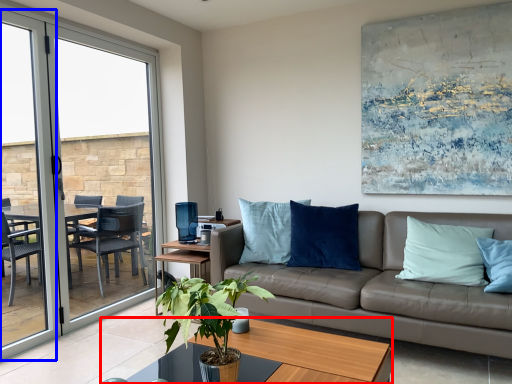
Question: Which point is closer to the camera, coffee table (highlighted by a red box) or screen door (highlighted by a blue box)?

Choices:
 (A) coffee table
 (B) screen door

Answer: (A)